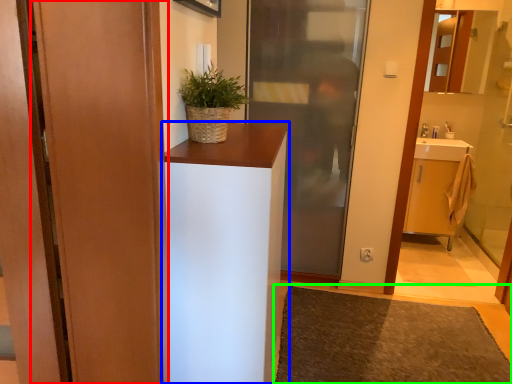
Question: Which is farther away from door (highlighted by a red box)? cabinetry (highlighted by a blue box) or doormat (highlighted by a green box)?

Choices:
 (A) cabinetry
 (B) doormat

Answer: (B)